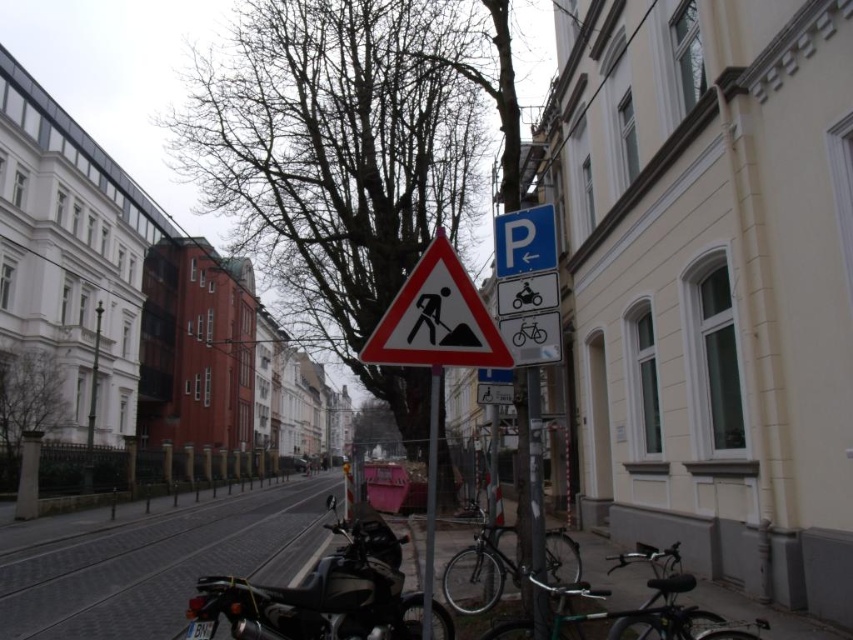
What do you see at coordinates (318, 593) in the screenshot?
I see `black matte motorcycle at center` at bounding box center [318, 593].

Can you confirm if black matte motorcycle at center is thinner than metallic pole at center?

No.

Does point (187, 636) lie behind point (428, 474)?

That is False.

Locate an element on the screen. This screenshot has width=853, height=640. black matte motorcycle at center is located at coordinates (318, 593).

Does point (448, 112) come farther from viewer compared to point (381, 342)?

Yes, point (448, 112) is behind point (381, 342).

Is point (265, 12) positioned behind point (479, 298)?

Yes, it is.

What are the coordinates of `bare branches at center` in the screenshot? It's located at (337, 160).

Who is higher up, shiny metallic bicycle at center or blue plastic parking sign at upper center?

blue plastic parking sign at upper center is above.

This screenshot has width=853, height=640. What do you see at coordinates (479, 572) in the screenshot?
I see `shiny metallic bicycle at center` at bounding box center [479, 572].

Find the location of `shiny metallic bicycle at center`. shiny metallic bicycle at center is located at coordinates (479, 572).